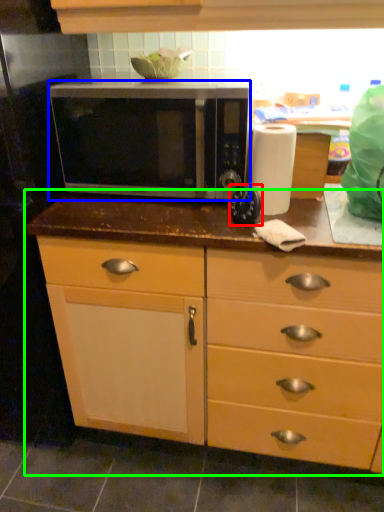
Question: Which is farther away from appliance (highlighted by a red box)? microwave oven (highlighted by a blue box) or cabinetry (highlighted by a green box)?

Choices:
 (A) microwave oven
 (B) cabinetry

Answer: (B)